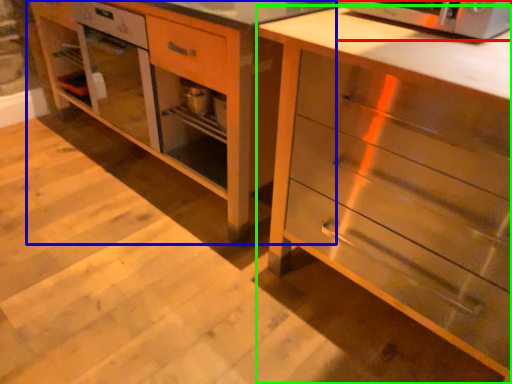
Question: Based on their relative distances, which object is nearer to microwave oven (highlighted by a red box)? Choose from vanity (highlighted by a blue box) and chest of drawers (highlighted by a green box).

Choices:
 (A) vanity
 (B) chest of drawers

Answer: (B)